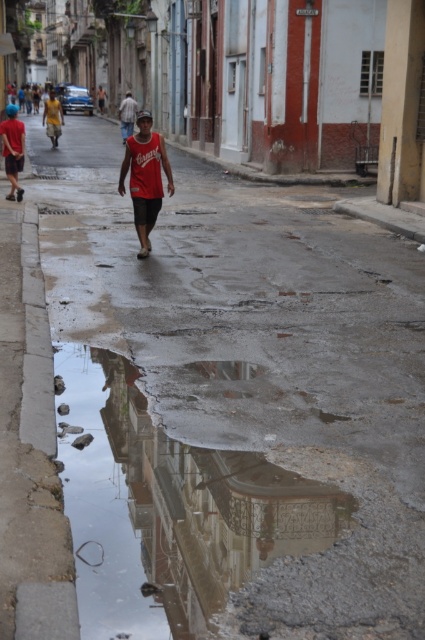
You are standing on the wet street and see two points marked on the ground. The first point is at coordinate point(192, 520) and the second point is at coordinate point(121, 124). Which point is closer to you?

Point(192, 520) is closer to the viewer than point(121, 124).

You are a photographer trying to capture the reflection of the historic buildings in the puddle. Given that the reflective concrete puddle at center is lower than the red cotton shirt at center, will the reflection of the buildings be visible in the puddle?

The reflective concrete puddle at center has a lesser height compared to the red cotton shirt at center, so the puddle is lower than the shirt. Since the puddle is lower, the reflection of the buildings may still be visible as long as the photographer positions themselves at an angle where the buildings are above the water level and the surface is calm enough to reflect.